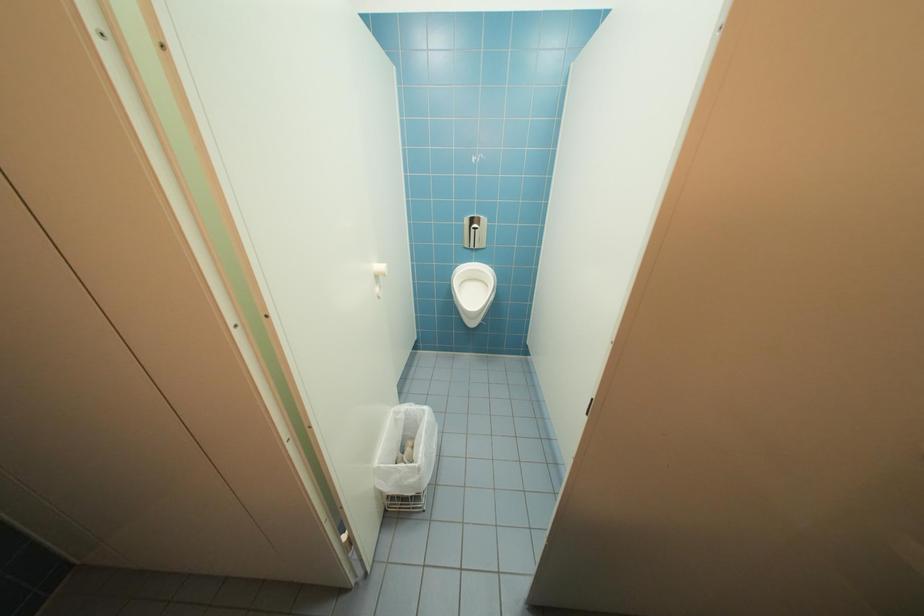
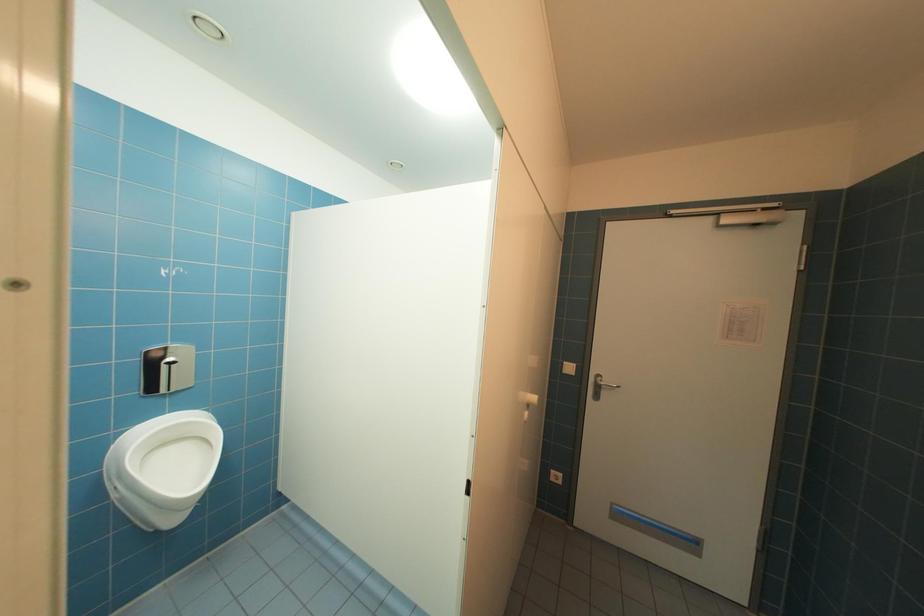
Question: The first image is from the beginning of the video and the second image is from the end. How did the camera likely rotate when shooting the video?

Choices:
 (A) Left
 (B) Right
 (C) Up
 (D) Down

Answer: (B)